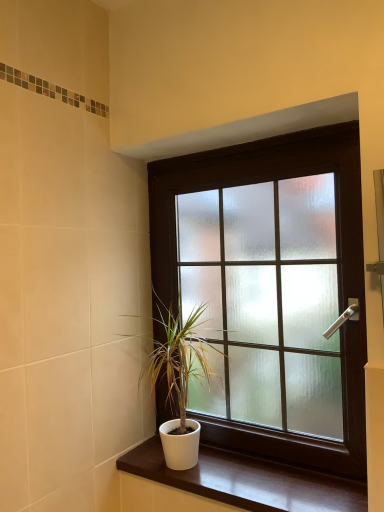
What do you see at coordinates (271, 291) in the screenshot?
I see `frosted glass window at center` at bounding box center [271, 291].

The height and width of the screenshot is (512, 384). In order to click on white glossy wood at lower center in this screenshot , I will do `click(247, 481)`.

Would you say white glossy wood at lower center is inside or outside frosted glass window at center?

white glossy wood at lower center lies outside frosted glass window at center.

From the image's perspective, is white glossy wood at lower center under frosted glass window at center?

Yes.

From the picture: In the image, is white glossy wood at lower center on the left side or the right side of frosted glass window at center?

Clearly, white glossy wood at lower center is on the left of frosted glass window at center in the image.

Looking at this image, considering the sizes of objects white glossy wood at lower center and frosted glass window at center in the image provided, who is wider, white glossy wood at lower center or frosted glass window at center?

With larger width is white glossy wood at lower center.

Can you confirm if frosted glass window at center is wider than white matte pot at lower center?

In fact, frosted glass window at center might be narrower than white matte pot at lower center.

Which of these two, frosted glass window at center or white matte pot at lower center, is bigger?

frosted glass window at center is bigger.

From a real-world perspective, who is located higher, frosted glass window at center or white matte pot at lower center?

frosted glass window at center, from a real-world perspective.

Is frosted glass window at center positioned beyond the bounds of white matte pot at lower center?

Indeed, frosted glass window at center is completely outside white matte pot at lower center.

Does white matte pot at lower center turn towards white glossy wood at lower center?

No.

Is white matte pot at lower center directly adjacent to white glossy wood at lower center?

No, white matte pot at lower center is not touching white glossy wood at lower center.

From the image's perspective, which is below, white matte pot at lower center or white glossy wood at lower center?

white glossy wood at lower center appears lower in the image.

From a real-world perspective, is white matte pot at lower center physically located above or below white glossy wood at lower center?

Clearly, from a real-world perspective, white matte pot at lower center is above white glossy wood at lower center.

Does white glossy wood at lower center appear on the right side of white matte pot at lower center?

Indeed, white glossy wood at lower center is positioned on the right side of white matte pot at lower center.

Is white glossy wood at lower center turned away from white matte pot at lower center?

That's not correct — white glossy wood at lower center is not looking away from white matte pot at lower center.

Consider the image. Measure the distance from white glossy wood at lower center to white matte pot at lower center.

white glossy wood at lower center and white matte pot at lower center are 9.80 inches apart.

Is white glossy wood at lower center in front of white matte pot at lower center?

Yes, white glossy wood at lower center is in front of white matte pot at lower center.

Is white matte pot at lower center next to frosted glass window at center?

No, white matte pot at lower center is not in contact with frosted glass window at center.

In the scene shown: From a real-world perspective, is white matte pot at lower center physically located above or below frosted glass window at center?

From a real-world perspective, white matte pot at lower center is physically below frosted glass window at center.

Which object is positioned more to the left, white matte pot at lower center or frosted glass window at center?

white matte pot at lower center is more to the left.

Is white matte pot at lower center oriented towards frosted glass window at center?

No, white matte pot at lower center is not oriented towards frosted glass window at center.

Does frosted glass window at center have a greater height compared to white glossy wood at lower center?

Indeed, frosted glass window at center has a greater height compared to white glossy wood at lower center.

Considering the positions of points (165, 243) and (305, 507), is point (165, 243) closer to camera compared to point (305, 507)?

No, it is not.

From a real-world perspective, who is located lower, frosted glass window at center or white glossy wood at lower center?

white glossy wood at lower center.

Which of these two, frosted glass window at center or white glossy wood at lower center, is thinner?

Thinner between the two is frosted glass window at center.

Find the location of a particular element. The height and width of the screenshot is (512, 384). window sill below the frosted glass window at center (from a real-world perspective) is located at coordinates (247, 481).

Identify the location of window above the white matte pot at lower center (from the image's perspective). The height and width of the screenshot is (512, 384). (271, 291).

From the image, which object appears to be nearer to frosted glass window at center, white glossy wood at lower center or white matte pot at lower center?

Among the two, white matte pot at lower center is located nearer to frosted glass window at center.

Estimate the real-world distances between objects in this image. Which object is closer to white glossy wood at lower center, frosted glass window at center or white matte pot at lower center?

Among the two, white matte pot at lower center is located nearer to white glossy wood at lower center.

Which object lies nearer to the anchor point white matte pot at lower center, frosted glass window at center or white glossy wood at lower center?

frosted glass window at center lies closer to white matte pot at lower center than the other object.

When comparing their distances from white matte pot at lower center, does white glossy wood at lower center or frosted glass window at center seem closer?

Based on the image, frosted glass window at center appears to be nearer to white matte pot at lower center.

Which object lies further to the anchor point white glossy wood at lower center, white matte pot at lower center or frosted glass window at center?

Among the two, frosted glass window at center is located further to white glossy wood at lower center.

From the image, which object appears to be farther from frosted glass window at center, white matte pot at lower center or white glossy wood at lower center?

Based on the image, white glossy wood at lower center appears to be further to frosted glass window at center.

Where is `houseplant between frosted glass window at center and white glossy wood at lower center from top to bottom`? This screenshot has height=512, width=384. houseplant between frosted glass window at center and white glossy wood at lower center from top to bottom is located at coordinates (179, 380).